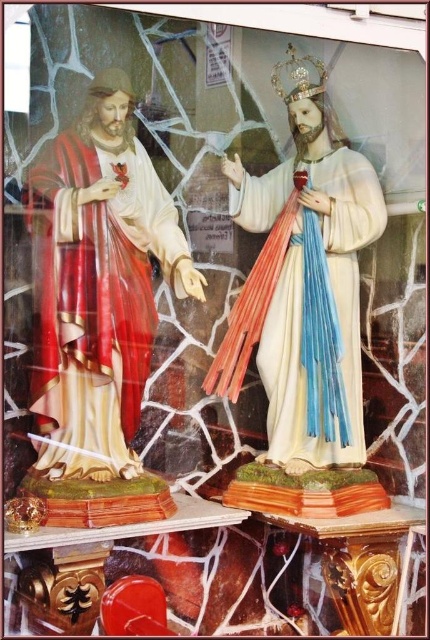
Does point (39, 193) come closer to viewer compared to point (316, 88)?

Yes, point (39, 193) is closer to viewer.

Looking at this image, is the position of shiny red fabric robe at left less distant than that of gold metallic crown at upper center?

Yes, shiny red fabric robe at left is in front of gold metallic crown at upper center.

This screenshot has width=430, height=640. Identify the location of shiny red fabric robe at left. (97, 298).

Does point (294, 298) come farther from viewer compared to point (319, 70)?

Yes, it is.

Can you confirm if white glossy robe at center is wider than gold metallic crown at upper center?

Indeed, white glossy robe at center has a greater width compared to gold metallic crown at upper center.

Find the location of a particular element. The image size is (430, 640). white glossy robe at center is located at coordinates click(335, 307).

Does shiny red fabric robe at left have a lesser height compared to white glossy robe at center?

Yes.

Which is above, shiny red fabric robe at left or white glossy robe at center?

white glossy robe at center is above.

Is point (40, 392) positioned after point (334, 237)?

That is False.

The height and width of the screenshot is (640, 430). I want to click on shiny red fabric robe at left, so click(x=97, y=298).